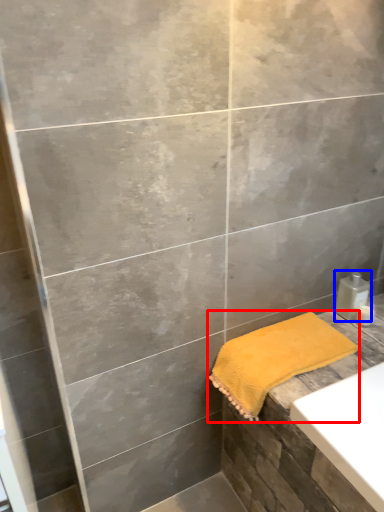
Question: Among these objects, which one is nearest to the camera, towel (highlighted by a red box) or soap dispenser (highlighted by a blue box)?

Choices:
 (A) towel
 (B) soap dispenser

Answer: (A)